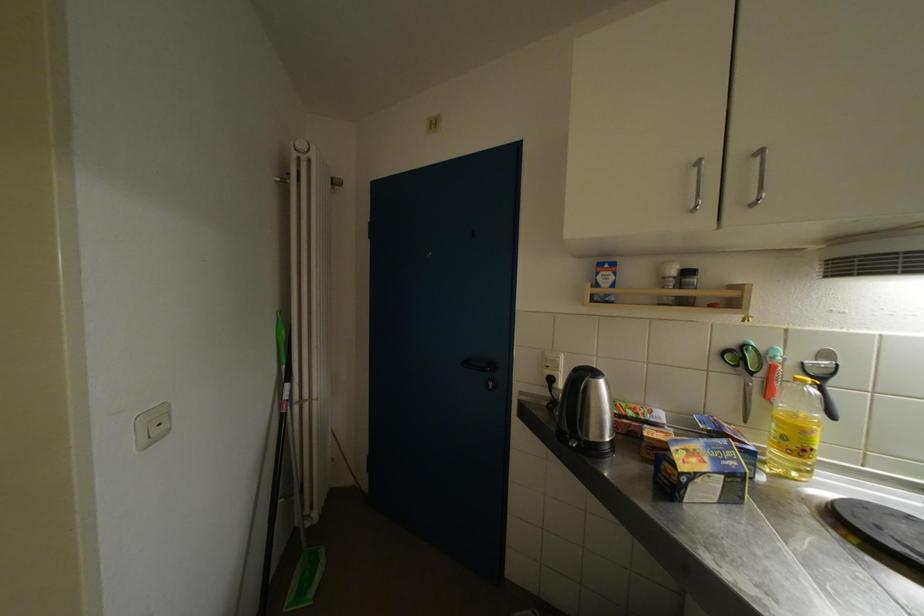
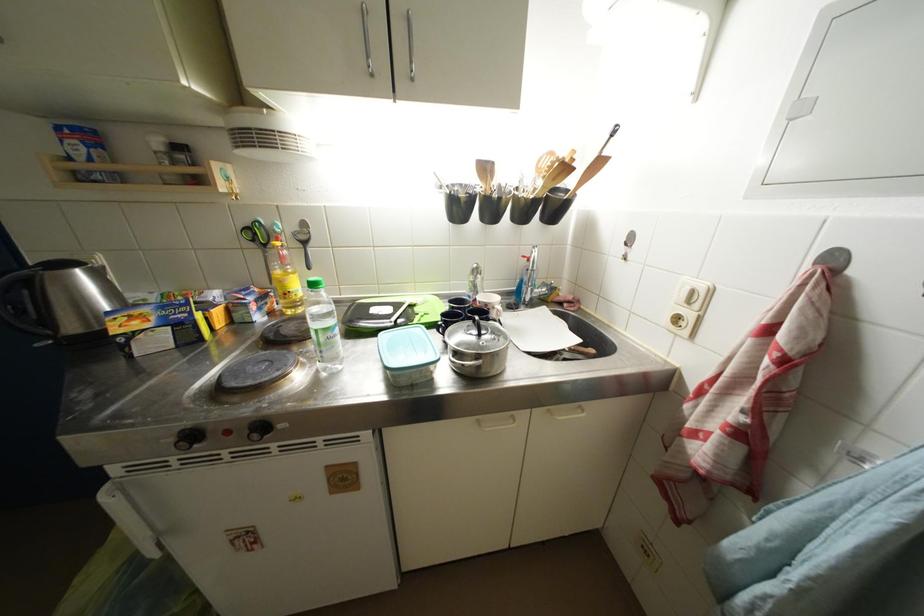
Find the pixel in the second image that matches point (758, 378) in the first image.

(272, 249)